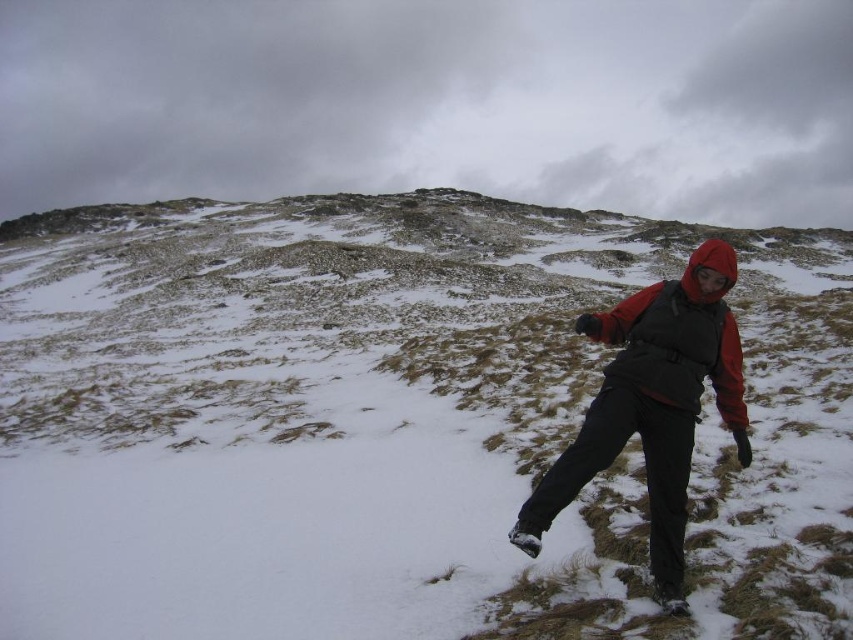
You are a hiker trying to navigate the snowy terrain. You see the white powdery snow at center and the red fleece jacket at right. Which object is nearer to you as you stand on the trail?

The white powdery snow at center is closer to the viewer than the red fleece jacket at right, so the white powdery snow at center is nearer to you.

The hiker is trying to decide where to place their next step. They have to choose between the white powdery snow at center and the red fleece jacket at right. Which option is a safer choice for their footing?

The white powdery snow at center is larger in size than the red fleece jacket at right, so the hiker should choose the white powdery snow at center for better footing as it provides a more stable surface.

You are a hiker trying to decide which jacket to wear for a cold mountain hike. You have a matte black jacket at center and a red fleece jacket at right. Which jacket would be more suitable for keeping warm, and why?

The matte black jacket at center is bigger than the red fleece jacket at right, so it would provide more insulation and better warmth for the cold mountain hike.